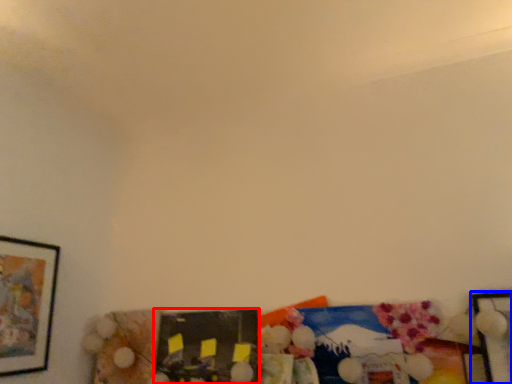
Question: Which object appears closest to the camera in this image, picture frame (highlighted by a red box) or picture frame (highlighted by a blue box)?

Choices:
 (A) picture frame
 (B) picture frame

Answer: (B)